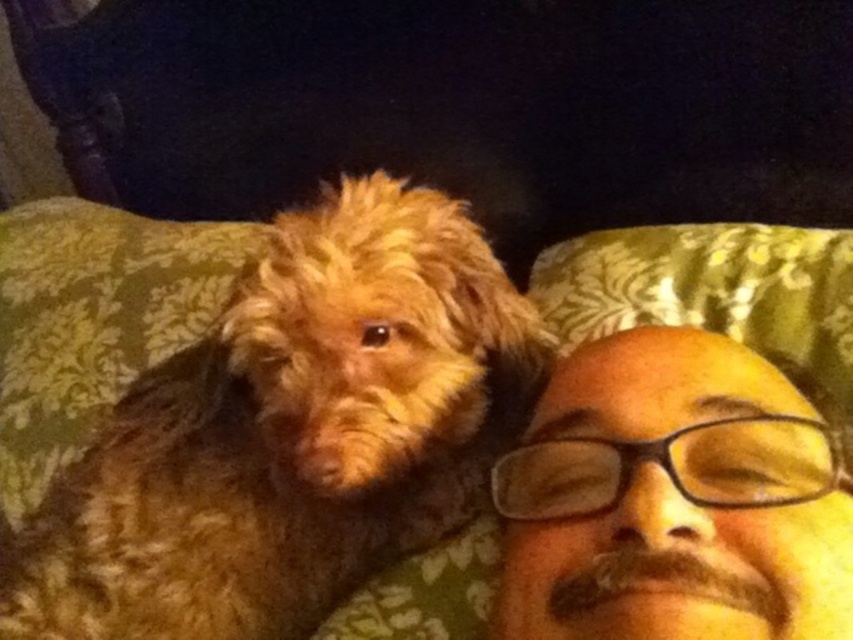
You are a photographer trying to capture the interaction between the fuzzy brown dog at upper left and the brown matte face at upper right. Since you want to ensure both subjects are in focus, you need to know which one is taller. Can you determine which subject is taller?

The fuzzy brown dog at upper left is taller than the brown matte face at upper right, so you should adjust your camera settings to focus on the taller subject first.

You are a photographer who wants to capture a closeup of the brown matte face at upper right without including the fuzzy brown dog at upper left in the frame. Is this possible given their positions?

The fuzzy brown dog at upper left is above the brown matte face at upper right, so adjusting the camera angle downward might exclude the dog while focusing on the face.